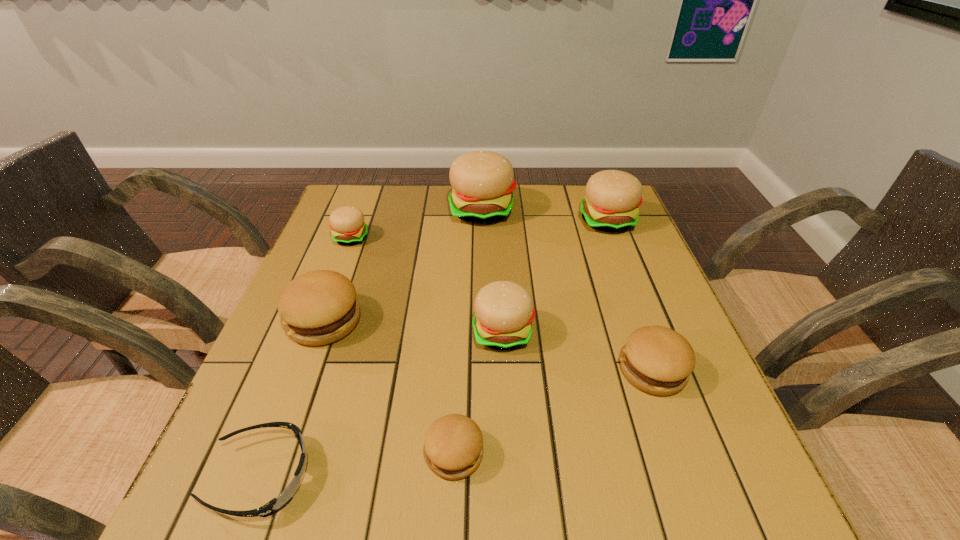
Find the location of a particular element. The width and height of the screenshot is (960, 540). the biggest beige hamburger is located at coordinates coord(482,182).

Find the location of a particular element. The width and height of the screenshot is (960, 540). the tallest hamburger is located at coordinates (482, 182).

Where is `the rightmost beige hamburger`? Image resolution: width=960 pixels, height=540 pixels. the rightmost beige hamburger is located at coordinates (612, 200).

In order to click on the second biggest beige hamburger in this screenshot , I will do `click(612, 200)`.

You are a GUI agent. You are given a task and a screenshot of the screen. Output one action in this format:
    pyautogui.click(x=<x>, y=<y>)
    Task: Click on the second smallest beige hamburger
    The image size is (960, 540).
    Given the screenshot: What is the action you would take?
    pyautogui.click(x=504, y=312)

Where is `the biggest brown hamburger`? the biggest brown hamburger is located at coordinates (319, 307).

Identify the location of the rightmost brown hamburger. pyautogui.click(x=658, y=360).

The image size is (960, 540). In order to click on the smallest beige hamburger in this screenshot , I will do `click(347, 225)`.

Where is `the second brown hamburger from right to left`? The width and height of the screenshot is (960, 540). the second brown hamburger from right to left is located at coordinates (453, 444).

At what (x,y) coordinates should I click in order to perform the action: click on the second shortest object. Please return your answer as a coordinate pair (x, y). The height and width of the screenshot is (540, 960). Looking at the image, I should click on (453, 444).